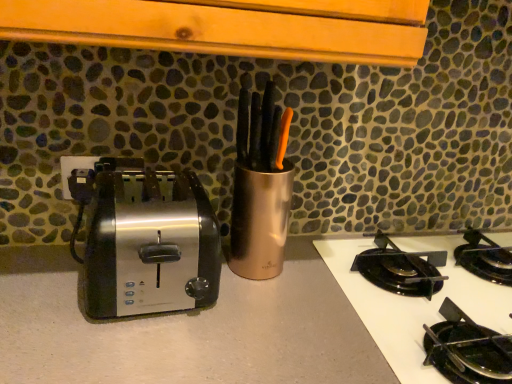
Where is `free location in front of satin metallic toaster at left`? Image resolution: width=512 pixels, height=384 pixels. free location in front of satin metallic toaster at left is located at coordinates (121, 347).